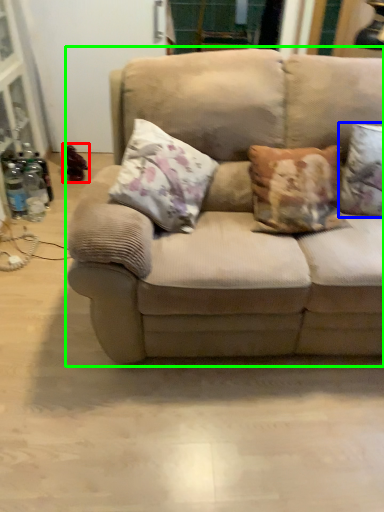
Question: Considering the real-world distances, which object is closest to toy (highlighted by a red box)? pillow (highlighted by a blue box) or studio couch (highlighted by a green box).

Choices:
 (A) pillow
 (B) studio couch

Answer: (B)